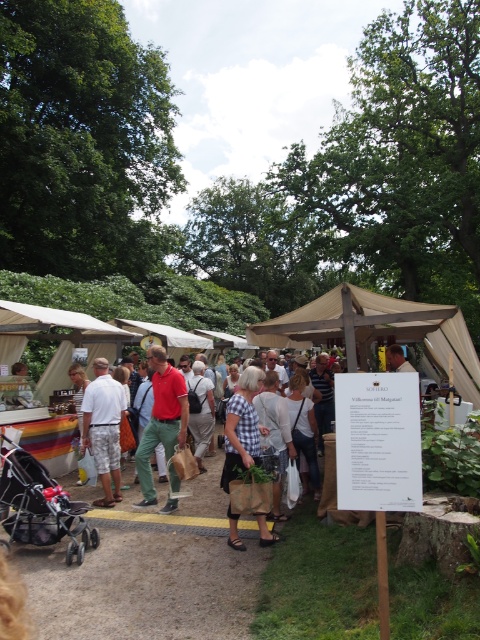
In the scene shown: You are at the outdoor market and see a brown paper bag at center and green cotton pants at center. Which item is located to the right of the other?

The brown paper bag at center is positioned on the right side of green cotton pants at center.

You are a vendor at the outdoor market and want to hang a decorative banner between the beige canvas canopy at center and the checkered fabric dress at center. Which object should you attach the banner to if you want it to be wider?

The beige canvas canopy at center has a greater width than the checkered fabric dress at center, so you should attach the banner to the beige canvas canopy at center to make it wider.

You are a customer at the outdoor market and want to buy both the green cotton pants at center and the white cotton shorts at center. If you first approach the item closer to you, which one should you pick up first?

The green cotton pants at center is closer to the viewer than the white cotton shorts at center, so you should pick up the green cotton pants at center first.